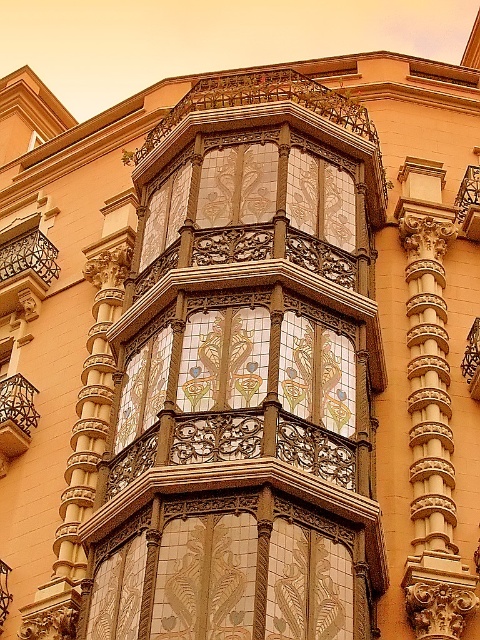
Question: Which point is farther from the camera taking this photo?

Choices:
 (A) (9, 426)
 (B) (48, 276)

Answer: (B)

Question: Is the position of black wrought iron balcony at upper left less distant than that of black wrought iron balcony at center?

Choices:
 (A) no
 (B) yes

Answer: (A)

Question: Is black wrought iron balcony at upper left positioned in front of black wrought iron balcony at center?

Choices:
 (A) no
 (B) yes

Answer: (A)

Question: From the image, what is the correct spatial relationship of black wrought iron balcony at upper left in relation to black wrought iron balcony at center?

Choices:
 (A) left
 (B) right

Answer: (A)